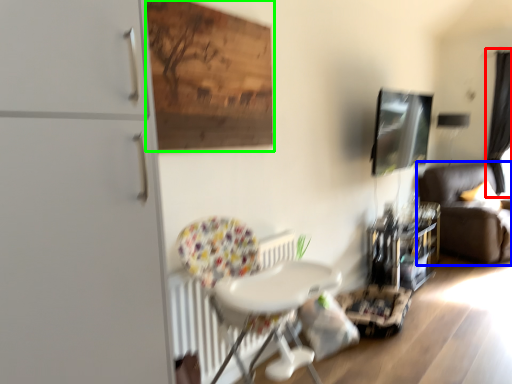
Question: Based on their relative distances, which object is nearer to curtain (highlighted by a red box)? Choose from studio couch (highlighted by a blue box) and plywood (highlighted by a green box).

Choices:
 (A) studio couch
 (B) plywood

Answer: (A)